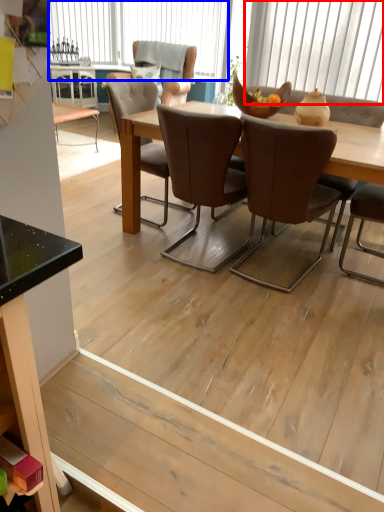
Question: Which of the following is the farthest to the observer, window (highlighted by a red box) or window (highlighted by a blue box)?

Choices:
 (A) window
 (B) window

Answer: (B)